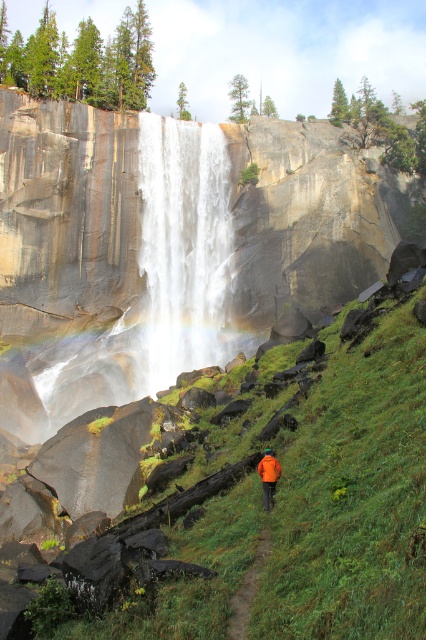
Question: Which object is closer to the camera taking this photo?

Choices:
 (A) white translucent water at center
 (B) green grassy trail at lower center
 (C) orange fabric jacket at center

Answer: (B)

Question: In this image, where is green grassy trail at lower center located relative to orange fabric jacket at center?

Choices:
 (A) above
 (B) below

Answer: (B)

Question: Does white translucent water at center have a smaller size compared to orange fabric jacket at center?

Choices:
 (A) yes
 (B) no

Answer: (B)

Question: Estimate the real-world distances between objects in this image. Which object is farther from the orange fabric jacket at center?

Choices:
 (A) green grassy trail at lower center
 (B) white translucent water at center

Answer: (B)

Question: Which point is farther to the camera?

Choices:
 (A) orange fabric jacket at center
 (B) green grassy trail at lower center
 (C) white translucent water at center

Answer: (C)

Question: Observing the image, what is the correct spatial positioning of green grassy trail at lower center in reference to orange fabric jacket at center?

Choices:
 (A) left
 (B) right

Answer: (A)